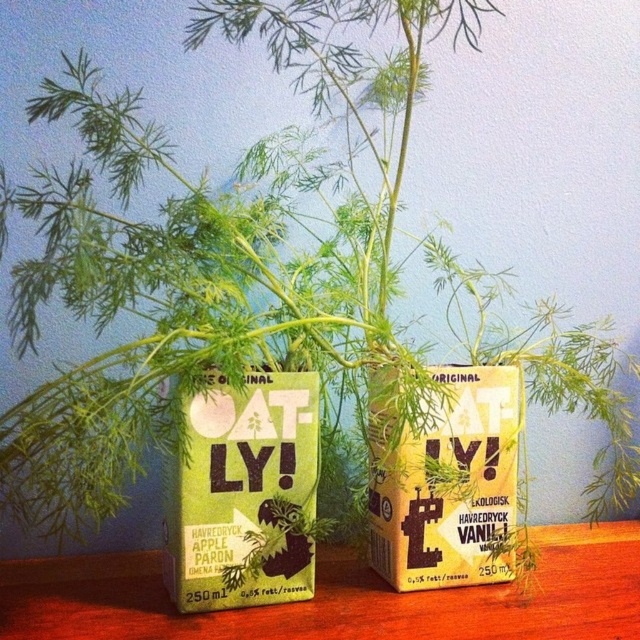
Question: Among these objects, which one is nearest to the camera?

Choices:
 (A) green matte carton at center
 (B) wooden table at center

Answer: (B)

Question: Which of the following is the farthest from the observer?

Choices:
 (A) green matte carton at center
 (B) wooden table at center

Answer: (A)

Question: Does wooden table at center have a lesser width compared to green matte carton at center?

Choices:
 (A) no
 (B) yes

Answer: (A)

Question: Observing the image, what is the correct spatial positioning of wooden table at center in reference to green matte carton at center?

Choices:
 (A) left
 (B) right

Answer: (B)

Question: Among these objects, which one is nearest to the camera?

Choices:
 (A) wooden table at center
 (B) yellow paper carton at center

Answer: (A)

Question: Does wooden table at center appear under yellow paper carton at center?

Choices:
 (A) no
 (B) yes

Answer: (B)